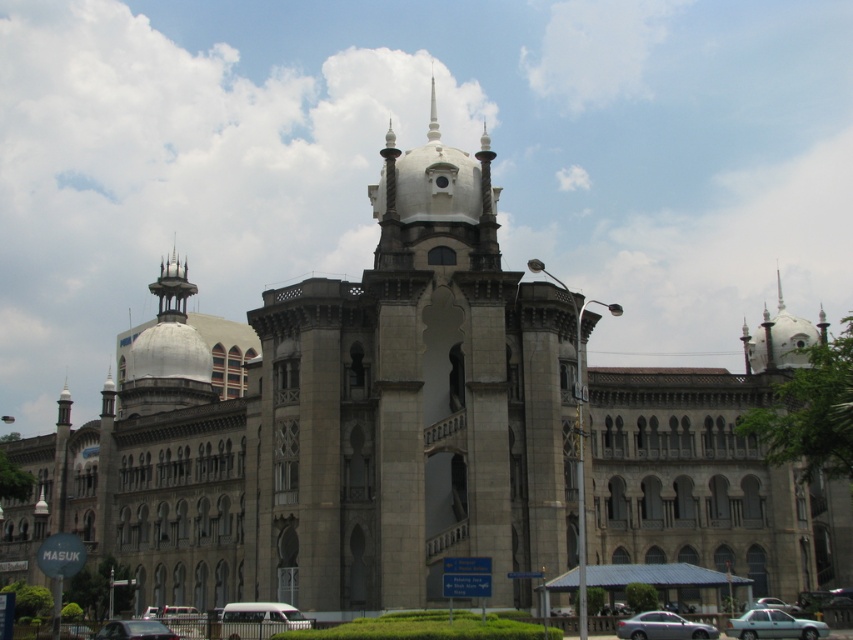
From the picture: Who is lower down, satin silver sedan at lower center or metallic silver car at lower right?

metallic silver car at lower right is lower down.

Is satin silver sedan at lower center behind metallic silver car at lower right?

No, satin silver sedan at lower center is in front of metallic silver car at lower right.

Is point (643, 634) more distant than point (780, 608)?

No.

Locate an element on the screen. Image resolution: width=853 pixels, height=640 pixels. satin silver sedan at lower center is located at coordinates (663, 627).

Can you confirm if light blue metallic car at lower right is positioned to the right of satin silver sedan at lower center?

Correct, you'll find light blue metallic car at lower right to the right of satin silver sedan at lower center.

Can you confirm if light blue metallic car at lower right is positioned above satin silver sedan at lower center?

Incorrect, light blue metallic car at lower right is not positioned above satin silver sedan at lower center.

At what (x,y) coordinates should I click in order to perform the action: click on light blue metallic car at lower right. Please return your answer as a coordinate pair (x, y). Looking at the image, I should click on (773, 625).

At what (x,y) coordinates should I click in order to perform the action: click on light blue metallic car at lower right. Please return your answer as a coordinate pair (x, y). The image size is (853, 640). Looking at the image, I should click on (773, 625).

Who is more forward, [752,637] or [99,637]?

Point [99,637] is in front.

At what (x,y) coordinates should I click in order to perform the action: click on light blue metallic car at lower right. Please return your answer as a coordinate pair (x, y). The image size is (853, 640). Looking at the image, I should click on (773, 625).